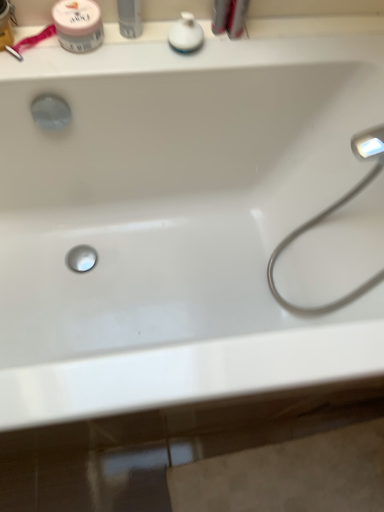
Question: Which direction should I rotate to face white glossy soap dispenser at upper center, which is counted as the first toiletry, starting from the right, — up or down?

Choices:
 (A) down
 (B) up

Answer: (B)

Question: Is pink matte jar at upper left looking in the opposite direction of white glossy soap dispenser at upper center, which is counted as the first toiletry, starting from the right?

Choices:
 (A) no
 (B) yes

Answer: (A)

Question: Is pink matte jar at upper left at the right side of white glossy soap dispenser at upper center, which is counted as the first toiletry, starting from the right?

Choices:
 (A) yes
 (B) no

Answer: (B)

Question: Is pink matte jar at upper left taller than white glossy soap dispenser at upper center, which is counted as the first toiletry, starting from the right?

Choices:
 (A) no
 (B) yes

Answer: (B)

Question: Can you confirm if pink matte jar at upper left is thinner than white glossy soap dispenser at upper center, which is counted as the first toiletry, starting from the right?

Choices:
 (A) yes
 (B) no

Answer: (B)

Question: Can you see pink matte jar at upper left touching white glossy soap dispenser at upper center, which is counted as the first toiletry, starting from the right?

Choices:
 (A) no
 (B) yes

Answer: (A)

Question: From the image's perspective, is pink matte jar at upper left above white glossy soap dispenser at upper center, which is counted as the first toiletry, starting from the right?

Choices:
 (A) no
 (B) yes

Answer: (B)

Question: Considering the relative sizes of white glossy spray can at upper center, which is the second toiletry from right to left, and white glossy soap dispenser at upper center, which is counted as the 2th toiletry, starting from the left, in the image provided, is white glossy spray can at upper center, which is the second toiletry from right to left, bigger than white glossy soap dispenser at upper center, which is counted as the 2th toiletry, starting from the left,?

Choices:
 (A) yes
 (B) no

Answer: (A)

Question: Does white glossy spray can at upper center, which is the second toiletry from right to left, have a lesser width compared to white glossy soap dispenser at upper center, which is counted as the first toiletry, starting from the right?

Choices:
 (A) yes
 (B) no

Answer: (A)

Question: Is white glossy spray can at upper center, which is the 1th toiletry in left-to-right order, to the left of white glossy soap dispenser at upper center, which is counted as the 2th toiletry, starting from the left, from the viewer's perspective?

Choices:
 (A) no
 (B) yes

Answer: (B)

Question: From a real-world perspective, is white glossy spray can at upper center, which is the 1th toiletry in left-to-right order, positioned under white glossy soap dispenser at upper center, which is counted as the first toiletry, starting from the right, based on gravity?

Choices:
 (A) yes
 (B) no

Answer: (B)

Question: From a real-world perspective, is white glossy spray can at upper center, which is the second toiletry from right to left, physically above white glossy soap dispenser at upper center, which is counted as the first toiletry, starting from the right?

Choices:
 (A) no
 (B) yes

Answer: (B)

Question: Is white glossy spray can at upper center, which is the second toiletry from right to left, closer to camera compared to white glossy soap dispenser at upper center, which is counted as the first toiletry, starting from the right?

Choices:
 (A) no
 (B) yes

Answer: (B)

Question: Is pink matte jar at upper left smaller than satin nickel faucet at right?

Choices:
 (A) yes
 (B) no

Answer: (A)